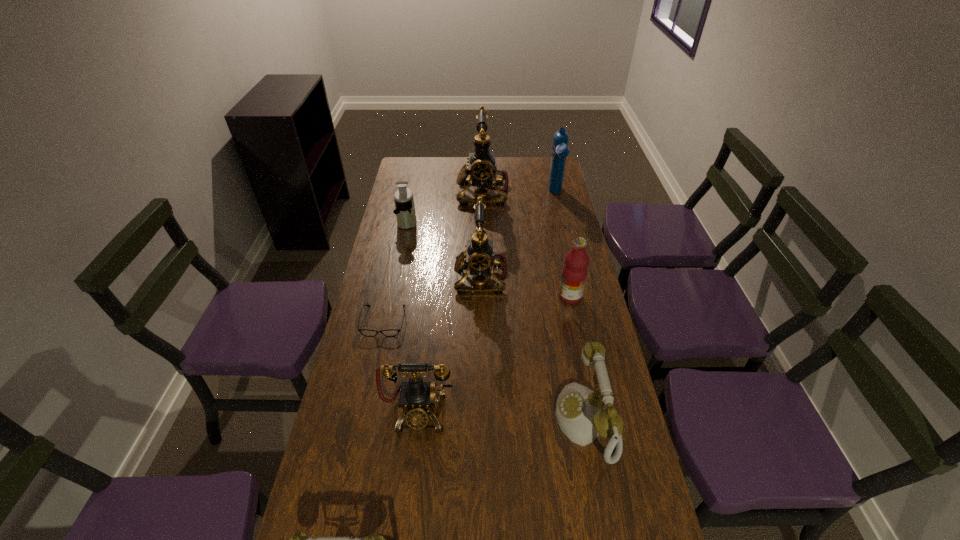
This screenshot has height=540, width=960. I want to click on the shortest object, so click(365, 332).

The width and height of the screenshot is (960, 540). I want to click on the sixth farthest object, so click(365, 332).

This screenshot has height=540, width=960. In order to click on vacant space located on the front of the farthest telephone, featuring the rotary dial in this screenshot , I will do `click(404, 192)`.

Locate an element on the screen. This screenshot has height=540, width=960. vacant position located on the front of the farthest telephone, featuring the rotary dial is located at coordinates (404, 192).

Where is `blank space located 0.240m on the front of the farthest telephone, featuring the rotary dial`? Image resolution: width=960 pixels, height=540 pixels. blank space located 0.240m on the front of the farthest telephone, featuring the rotary dial is located at coordinates (404, 192).

Identify the location of vacant region located on the front of the shampoo. (560, 211).

This screenshot has height=540, width=960. In order to click on blank area located 0.160m on the front of the second smallest black telephone, featuring the rotary dial in this screenshot , I will do click(411, 276).

Find the location of a particular element. The image size is (960, 540). free space located on the front of the second smallest black telephone, featuring the rotary dial is located at coordinates (383, 276).

This screenshot has width=960, height=540. Find the location of `vacant space located on the front of the second smallest black telephone, featuring the rotary dial`. vacant space located on the front of the second smallest black telephone, featuring the rotary dial is located at coordinates (416, 276).

Where is `free location located on the label of the fruit juice`? free location located on the label of the fruit juice is located at coordinates (516, 296).